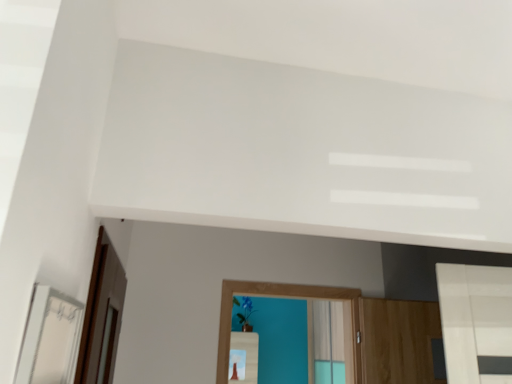
Based on the photo, measure the distance between point (76, 326) and camera.

Point (76, 326) and camera are 1.32 meters apart.

This screenshot has width=512, height=384. What do you see at coordinates (50, 338) in the screenshot?
I see `white glossy mirror at left` at bounding box center [50, 338].

You are a GUI agent. You are given a task and a screenshot of the screen. Output one action in this format:
    pyautogui.click(x=<x>, y=<y>)
    Task: Click on the white glossy mirror at left
    
    Given the screenshot: What is the action you would take?
    pyautogui.click(x=50, y=338)

Describe the element at coordinates (102, 316) in the screenshot. I see `brown wooden screen door at left` at that location.

Find the location of a particular element. The width and height of the screenshot is (512, 384). brown wooden screen door at left is located at coordinates (102, 316).

Where is `white glossy mirror at left`? white glossy mirror at left is located at coordinates (50, 338).

Which is more to the left, brown wooden screen door at left or white glossy mirror at left?

From the viewer's perspective, brown wooden screen door at left appears more on the left side.

In the image, is brown wooden screen door at left positioned in front of or behind white glossy mirror at left?

Visually, brown wooden screen door at left is located behind white glossy mirror at left.

Is point (120, 291) positioned after point (35, 295)?

Yes, it is behind point (35, 295).

From the image's perspective, is brown wooden screen door at left on white glossy mirror at left?

Incorrect, from the image's perspective, brown wooden screen door at left is lower than white glossy mirror at left.

From a real-world perspective, which is physically below, brown wooden screen door at left or white glossy mirror at left?

white glossy mirror at left.

Which object is thinner, brown wooden screen door at left or white glossy mirror at left?

With smaller width is white glossy mirror at left.

Which of these two, brown wooden screen door at left or white glossy mirror at left, stands shorter?

Standing shorter between the two is white glossy mirror at left.

Consider the image. Considering the sizes of brown wooden screen door at left and white glossy mirror at left in the image, is brown wooden screen door at left bigger or smaller than white glossy mirror at left?

In the image, brown wooden screen door at left appears to be larger than white glossy mirror at left.

Could white glossy mirror at left be considered to be inside brown wooden screen door at left?

No, brown wooden screen door at left does not contain white glossy mirror at left.

Is brown wooden screen door at left touching white glossy mirror at left?

No, brown wooden screen door at left is not in contact with white glossy mirror at left.

Is brown wooden screen door at left looking in the opposite direction of white glossy mirror at left?

No.

What's the angular difference between brown wooden screen door at left and white glossy mirror at left's facing directions?

0.0696 degrees.

Looking at this image, measure the distance between brown wooden screen door at left and white glossy mirror at left.

brown wooden screen door at left and white glossy mirror at left are 17.29 inches apart from each other.

Where is `screen door on the left side of white glossy mirror at left`? screen door on the left side of white glossy mirror at left is located at coordinates (102, 316).

Between white glossy mirror at left and brown wooden screen door at left, which one appears on the right side from the viewer's perspective?

From the viewer's perspective, white glossy mirror at left appears more on the right side.

Which object is further away from the camera, white glossy mirror at left or brown wooden screen door at left?

brown wooden screen door at left is more distant.

Does point (32, 355) appear closer or farther from the camera than point (102, 242)?

Point (32, 355) is closer to the camera than point (102, 242).

From the image's perspective, between white glossy mirror at left and brown wooden screen door at left, which one is located above?

From the image's view, white glossy mirror at left is above.

From a real-world perspective, is white glossy mirror at left beneath brown wooden screen door at left?

Yes, from a real-world perspective, white glossy mirror at left is under brown wooden screen door at left.

Considering the sizes of objects white glossy mirror at left and brown wooden screen door at left in the image provided, who is thinner, white glossy mirror at left or brown wooden screen door at left?

white glossy mirror at left.

In terms of height, does white glossy mirror at left look taller or shorter compared to brown wooden screen door at left?

In the image, white glossy mirror at left appears to be shorter than brown wooden screen door at left.

In terms of size, does white glossy mirror at left appear bigger or smaller than brown wooden screen door at left?

white glossy mirror at left is smaller than brown wooden screen door at left.

Is white glossy mirror at left spatially inside brown wooden screen door at left, or outside of it?

white glossy mirror at left is not inside brown wooden screen door at left, it's outside.

Is white glossy mirror at left positioned far away from brown wooden screen door at left?

No.

Could you tell me if white glossy mirror at left is turned towards brown wooden screen door at left?

No, white glossy mirror at left is not oriented towards brown wooden screen door at left.

At what (x,y) coordinates should I click in order to perform the action: click on mirror located above the brown wooden screen door at left (from the image's perspective). Please return your answer as a coordinate pair (x, y). This screenshot has height=384, width=512. Looking at the image, I should click on (50, 338).

At what (x,y) coordinates should I click in order to perform the action: click on screen door above the white glossy mirror at left (from a real-world perspective). Please return your answer as a coordinate pair (x, y). The height and width of the screenshot is (384, 512). Looking at the image, I should click on 102,316.

Identify the location of mirror above the brown wooden screen door at left (from the image's perspective). The image size is (512, 384). (50, 338).